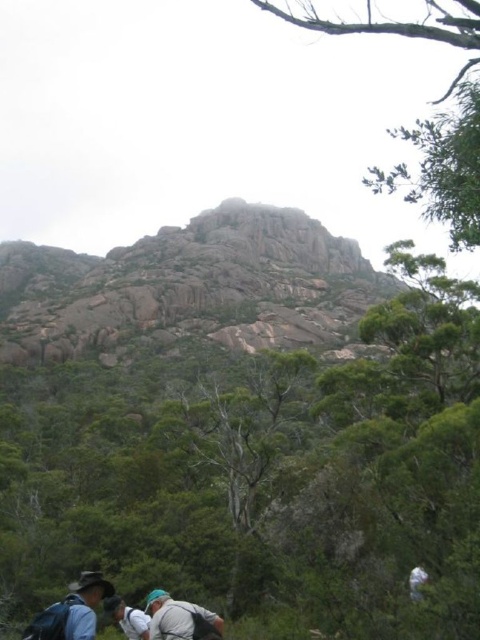
You are a hiker who wants to retrieve your water bottle from your backpack. You see the light blue fabric backpack at lower left and the light gray fabric backpack at lower center. Which backpack is currently accessible to you?

The light blue fabric backpack at lower left is positioned over the light gray fabric backpack at lower center, so the light gray fabric backpack at lower center is currently accessible.

You are hiking and see the rocky gray mountain at center and the light blue fabric backpack at lower left. Which object is wider?

The rocky gray mountain at center is wider than the light blue fabric backpack at lower left.

You are planning a hiking trip and need to choose between the light blue fabric backpack at lower left and the light gray fabric backpack at lower center. Based on their sizes, which backpack would be better suited for carrying more gear?

The light gray fabric backpack at lower center is larger in size compared to the light blue fabric backpack at lower left, making it better suited for carrying more gear.